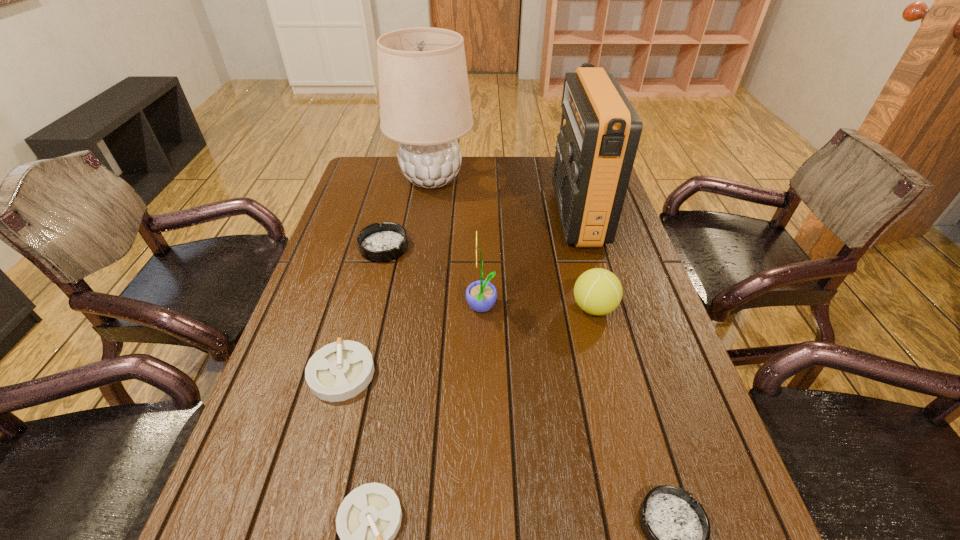
At what (x,y) coordinates should I click in order to perform the action: click on lampshade. Please return your answer as a coordinate pair (x, y). This screenshot has height=540, width=960. Looking at the image, I should click on (425, 105).

Where is `radio receiver`? radio receiver is located at coordinates (600, 130).

Identify the location of sunflower. (481, 295).

This screenshot has width=960, height=540. I want to click on green tennis ball, so click(x=597, y=291).

Identify the location of tennis ball. This screenshot has height=540, width=960. (597, 291).

You are a GUI agent. You are given a task and a screenshot of the screen. Output one action in this format:
    pyautogui.click(x=<x>, y=<y>)
    Task: Click on the bigger dark ashtray
    
    Given the screenshot: What is the action you would take?
    pyautogui.click(x=378, y=243)

In order to click on the farthest ashtray in this screenshot , I will do `click(378, 243)`.

Where is `the bigger gray ashtray`? the bigger gray ashtray is located at coordinates (338, 371).

The width and height of the screenshot is (960, 540). I want to click on the farther gray ashtray, so click(338, 371).

Find the location of a particular element. This screenshot has height=540, width=960. free region located 0.270m on the front of the lampshade is located at coordinates (420, 254).